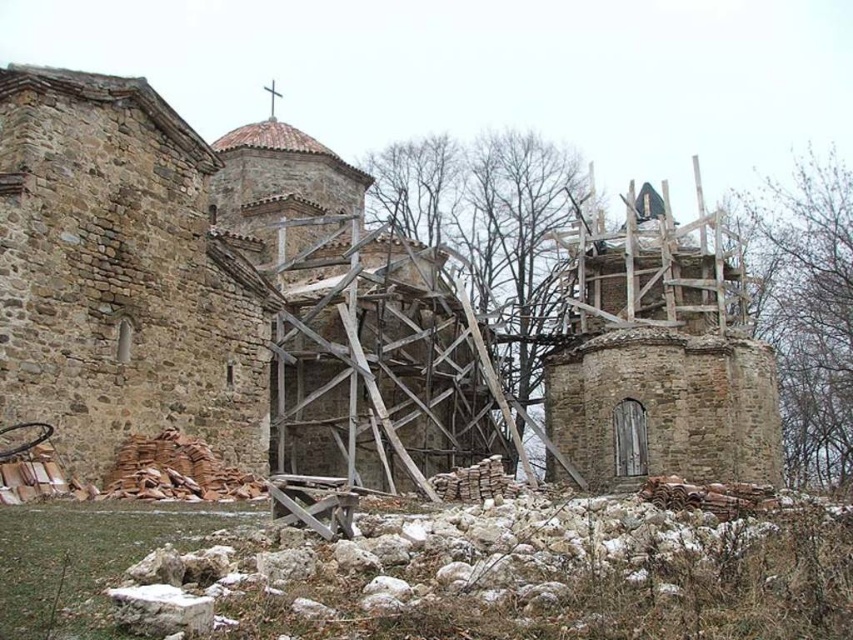
You are a construction worker standing at the base of the stone church at center. You notice stone rubble at right nearby. Which direction should you move to place the rubble closer to the church?

The stone church at center is positioned under the stone rubble at right, so you should move the rubble to the left to place it closer to the church.

You are a restoration worker standing at the base of the stone church at center. You need to move a heavy tool from the ground to the top of the stone rubble at right. Which object will require more effort to lift the tool to its top?

The stone rubble at right requires more effort because it is taller than the stone church at center according to the description.

You are a construction worker who needs to move a 30 feet long beam from the stone rubble at right to the stone church at center. Can you safely transport the beam without having to cut it into shorter pieces?

The distance between the stone church at center and the stone rubble at right is 31.30 feet. Since the beam is 30 feet long, it can be transported without needing to be cut as the distance is slightly longer than the beam.